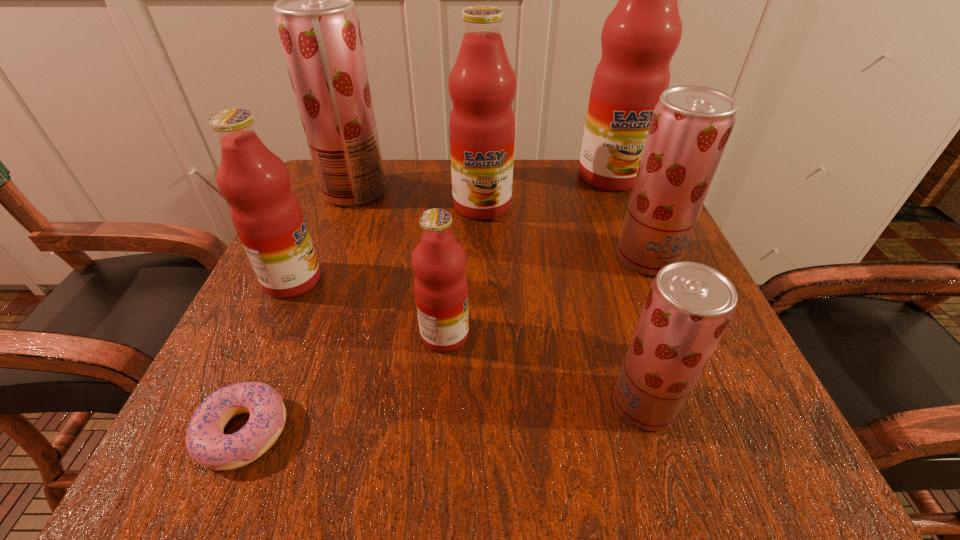
This screenshot has height=540, width=960. Find the location of `free space located on the back of the nearest fruit juice`. free space located on the back of the nearest fruit juice is located at coordinates (605, 274).

Identify the location of vacant space located 0.140m on the back of the doughnut. (291, 319).

At what (x,y) coordinates should I click in order to perform the action: click on fruit juice that is at the near edge. Please return your answer as a coordinate pair (x, y). This screenshot has width=960, height=540. Looking at the image, I should click on (689, 305).

Locate an element on the screen. doughnut at the near edge is located at coordinates (206, 443).

This screenshot has height=540, width=960. I want to click on doughnut positioned at the left edge, so click(x=206, y=443).

The height and width of the screenshot is (540, 960). Identify the location of object situated at the far left corner. tap(318, 28).

Identify the location of object present at the near left corner. (206, 443).

You are a GUI agent. You are given a task and a screenshot of the screen. Output one action in this format:
    pyautogui.click(x=<x>, y=<y>)
    Task: Click on the object located at the far right corner
    The width and height of the screenshot is (960, 540).
    Given the screenshot: What is the action you would take?
    pyautogui.click(x=639, y=37)

At what (x,y) coordinates should I click in order to perform the action: click on object present at the near right corner. Please return your answer as a coordinate pair (x, y). The height and width of the screenshot is (540, 960). Looking at the image, I should click on (689, 305).

Where is `free location at the far edge of the desktop`? free location at the far edge of the desktop is located at coordinates (441, 168).